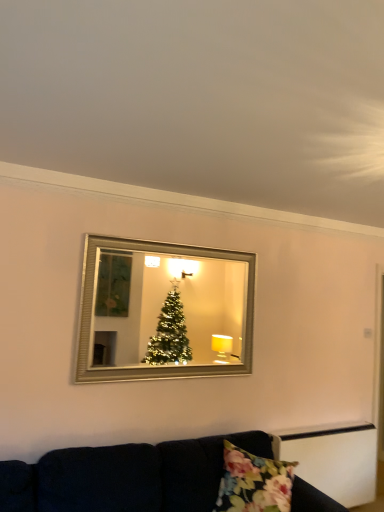
Question: Is floral fabric pillow at lower center wider than velvet dark blue couch at lower center?

Choices:
 (A) no
 (B) yes

Answer: (A)

Question: From a real-world perspective, does floral fabric pillow at lower center stand above velvet dark blue couch at lower center?

Choices:
 (A) no
 (B) yes

Answer: (B)

Question: Is floral fabric pillow at lower center at the right side of velvet dark blue couch at lower center?

Choices:
 (A) yes
 (B) no

Answer: (A)

Question: Is floral fabric pillow at lower center located outside velvet dark blue couch at lower center?

Choices:
 (A) yes
 (B) no

Answer: (B)

Question: Would you say velvet dark blue couch at lower center is part of floral fabric pillow at lower center's contents?

Choices:
 (A) no
 (B) yes

Answer: (A)

Question: Is point [100, 347] positioned closer to the camera than point [228, 448]?

Choices:
 (A) farther
 (B) closer

Answer: (A)

Question: In the image, is silver/glass mirror at upper center on the left side or the right side of floral fabric pillow at lower center?

Choices:
 (A) right
 (B) left

Answer: (B)

Question: Looking at the image, does silver/glass mirror at upper center seem bigger or smaller compared to floral fabric pillow at lower center?

Choices:
 (A) small
 (B) big

Answer: (A)

Question: Considering the positions of silver/glass mirror at upper center and floral fabric pillow at lower center in the image, is silver/glass mirror at upper center wider or thinner than floral fabric pillow at lower center?

Choices:
 (A) wide
 (B) thin

Answer: (B)

Question: Is velvet dark blue couch at lower center inside or outside of floral fabric pillow at lower center?

Choices:
 (A) inside
 (B) outside

Answer: (B)

Question: Is point (261, 435) positioned closer to the camera than point (241, 456)?

Choices:
 (A) farther
 (B) closer

Answer: (A)

Question: Based on their positions, is velvet dark blue couch at lower center located to the left or right of floral fabric pillow at lower center?

Choices:
 (A) left
 (B) right

Answer: (A)

Question: From the image's perspective, is velvet dark blue couch at lower center above or below floral fabric pillow at lower center?

Choices:
 (A) above
 (B) below

Answer: (B)

Question: Choose the correct answer: Is silver/glass mirror at upper center inside velvet dark blue couch at lower center or outside it?

Choices:
 (A) inside
 (B) outside

Answer: (B)

Question: Based on their sizes in the image, would you say silver/glass mirror at upper center is bigger or smaller than velvet dark blue couch at lower center?

Choices:
 (A) small
 (B) big

Answer: (A)